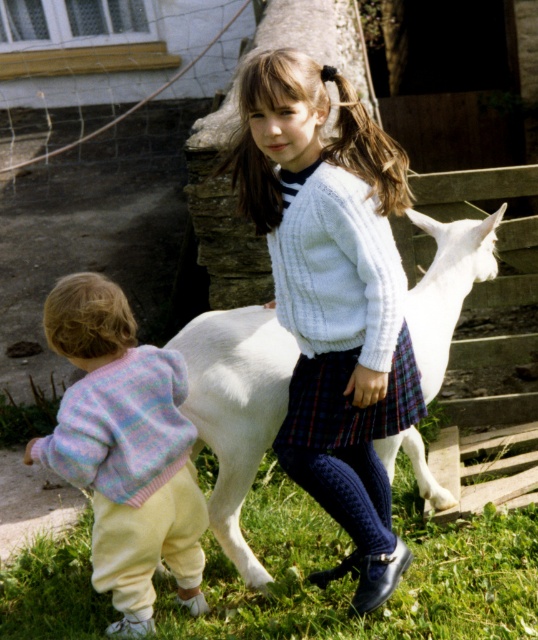
You are standing at point (350, 371) and want to walk to point (489, 616). Which direction should you move?

You should move forward because point (489, 616) is behind point (350, 371), meaning it is in the direction you are facing.

You are a photographer trying to capture the perfect shot of the children and the goat. You notice a point marked at coordinates (332, 296). Which child is this point indicating?

The point at coordinates (332, 296) marks the white knitted sweater at center.

You are a photographer wanting to capture the children and the goat. You notice the green grass at lower center and the pastel knitted sweater at lower left. Which object is located below the other?

The green grass at lower center is positioned under pastel knitted sweater at lower left.